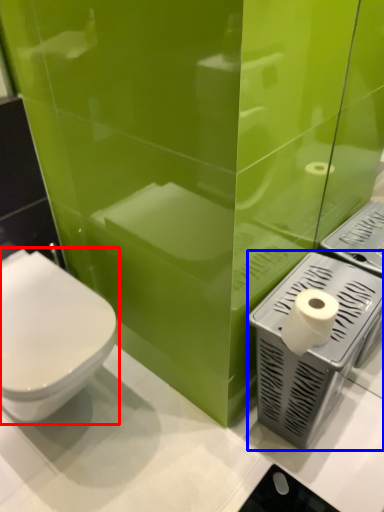
Question: Among these objects, which one is farthest to the camera, toilet (highlighted by a red box) or appliance (highlighted by a blue box)?

Choices:
 (A) toilet
 (B) appliance

Answer: (B)